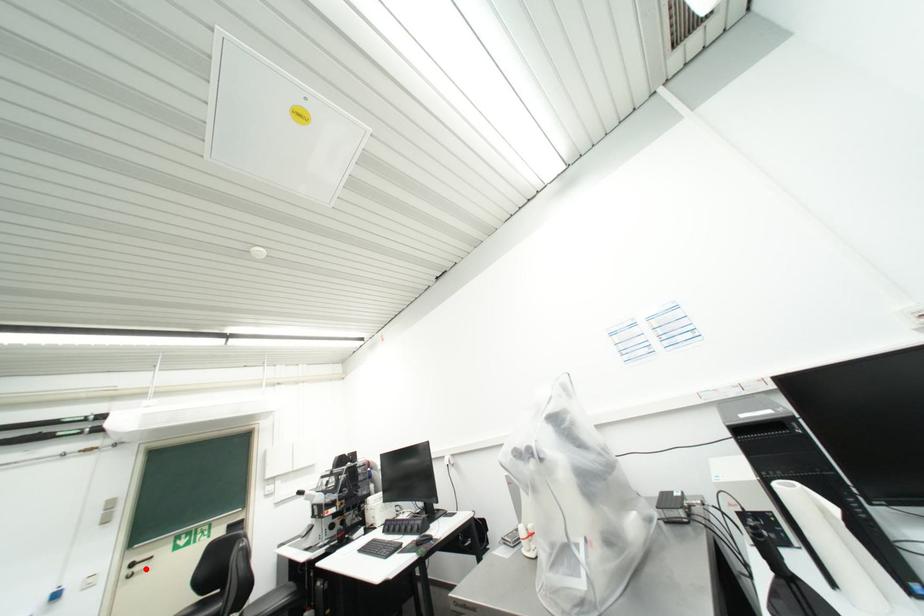
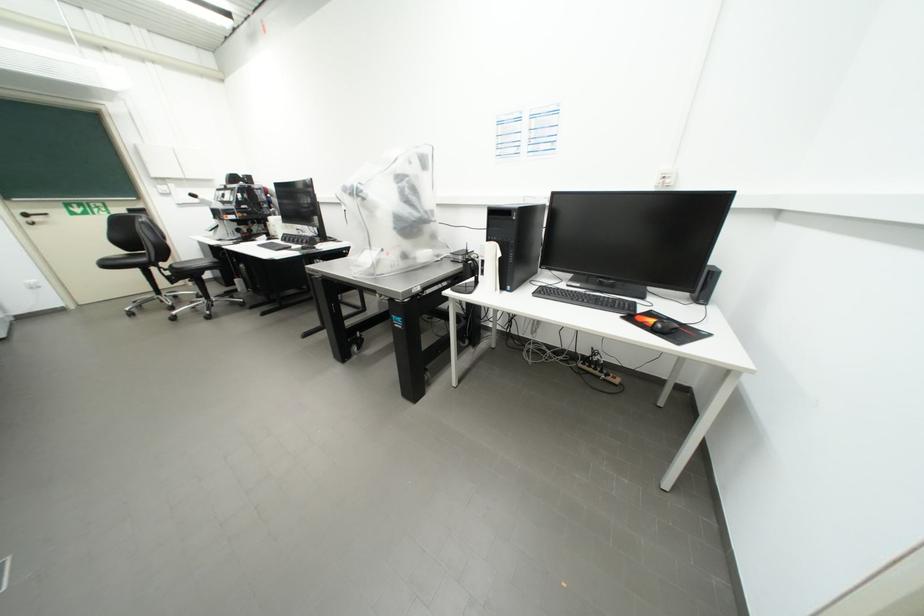
Where in the second image is the point corresponding to the highlighted location from the first image?

(43, 220)